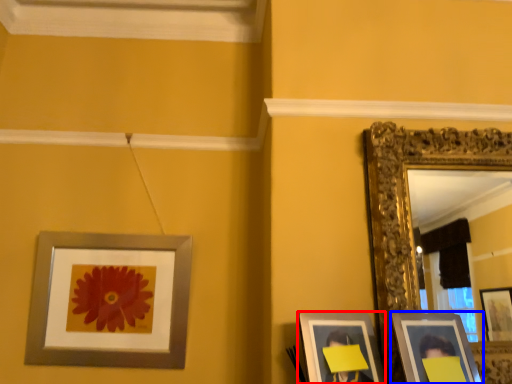
Question: Which point is closer to the camera, picture frame (highlighted by a red box) or picture frame (highlighted by a blue box)?

Choices:
 (A) picture frame
 (B) picture frame

Answer: (B)